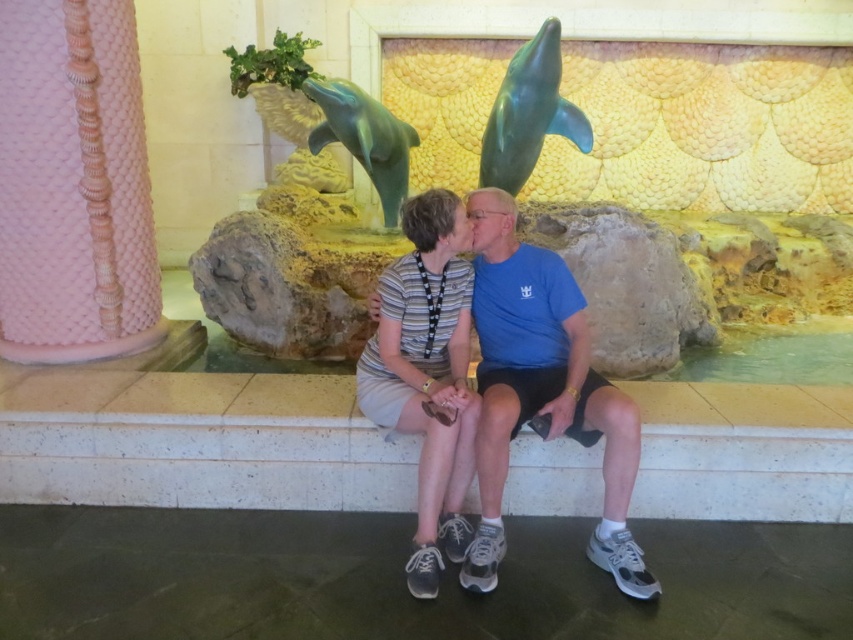
You are a photographer trying to capture a group photo of the blue cotton shirt at center and the striped fabric dress at center. Since you want to ensure both are clearly visible, which clothing item should you focus on first to avoid blurriness due to size differences?

The blue cotton shirt at center is bigger than the striped fabric dress at center, so you should focus on the blue cotton shirt at center first to ensure it is in sharp focus before the smaller one.

You are a photographer trying to capture a photo of the blue cotton shirt at center and the shiny green dolphin at upper center. Since you want both subjects to appear equally large in the photo, which object should you move closer to and which should you move away from?

The blue cotton shirt at center is thinner than the shiny green dolphin at upper center. To make both appear equally large, move closer to the blue cotton shirt at center and move away from the shiny green dolphin at upper center.